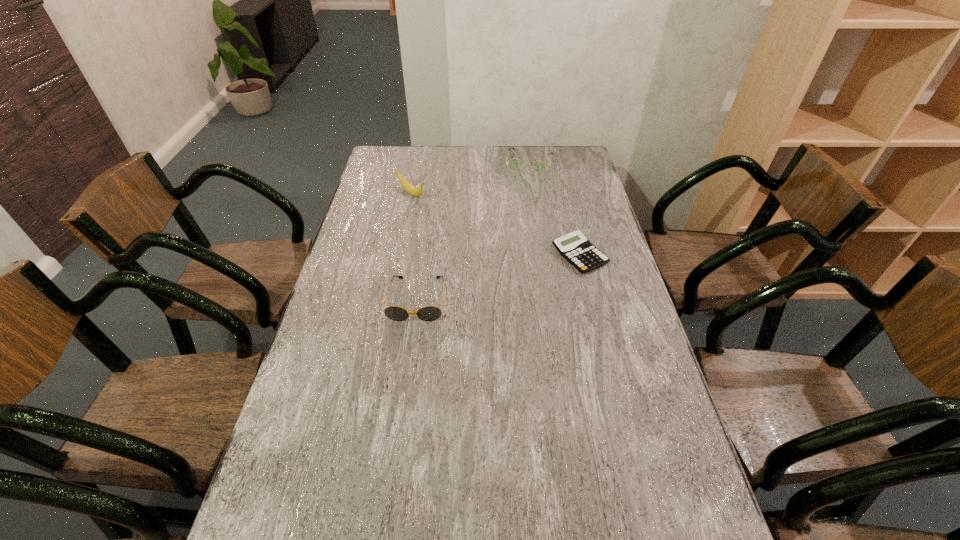
Find the location of a particular element. This screenshot has height=540, width=960. vacant space on the desktop that is between the sunglasses and the second nearest object and is positioned at the stem of the tallest object is located at coordinates (517, 273).

Find the location of a particular element. vacant space on the desktop that is between the sunglasses and the calculator and is positioned on the lenses of the farthest object is located at coordinates (493, 279).